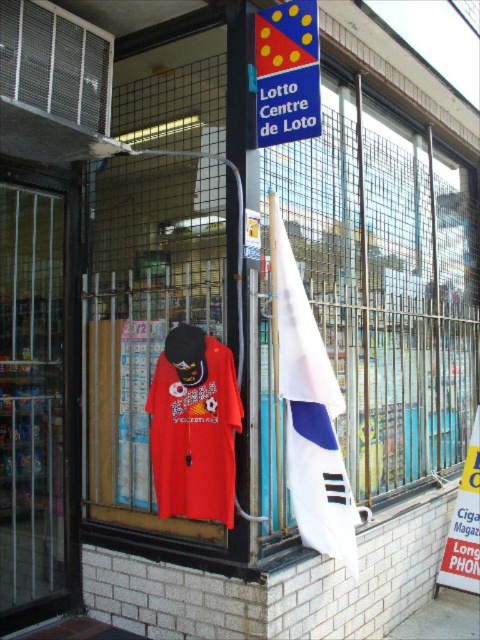
Does matte red t-shirt at center appear on the right side of white paper sign at lower right?

In fact, matte red t-shirt at center is to the left of white paper sign at lower right.

Which is behind, point (147, 408) or point (468, 529)?

Positioned behind is point (468, 529).

At what (x,y) coordinates should I click in order to perform the action: click on matte red t-shirt at center. Please return your answer as a coordinate pair (x, y). Looking at the image, I should click on (194, 428).

Does transparent glass door at left come in front of white paper sign at lower right?

Yes, it is in front of white paper sign at lower right.

Is transparent glass door at left thinner than white paper sign at lower right?

No, transparent glass door at left is not thinner than white paper sign at lower right.

Who is more distant from viewer, (73, 596) or (471, 438)?

The point (471, 438) is more distant.

Locate an element on the screen. This screenshot has width=480, height=640. transparent glass door at left is located at coordinates (38, 396).

Looking at this image, does white fabric flag at center lie in front of white paper sign at lower right?

Yes, white fabric flag at center is in front of white paper sign at lower right.

Is white fabric flag at center behind white paper sign at lower right?

No, it is in front of white paper sign at lower right.

This screenshot has width=480, height=640. In order to click on white fabric flag at center in this screenshot , I will do `click(309, 412)`.